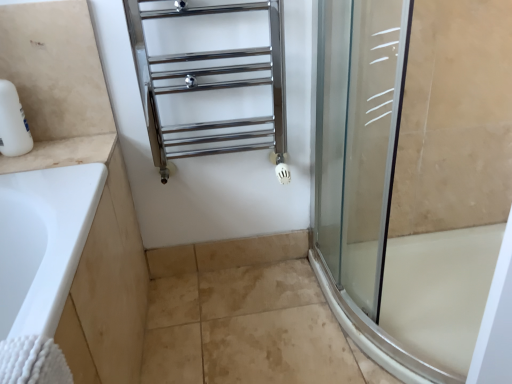
The height and width of the screenshot is (384, 512). What are the coordinates of `free point above white marble counter at left (from a real-world perspective)` in the screenshot? It's located at (51, 148).